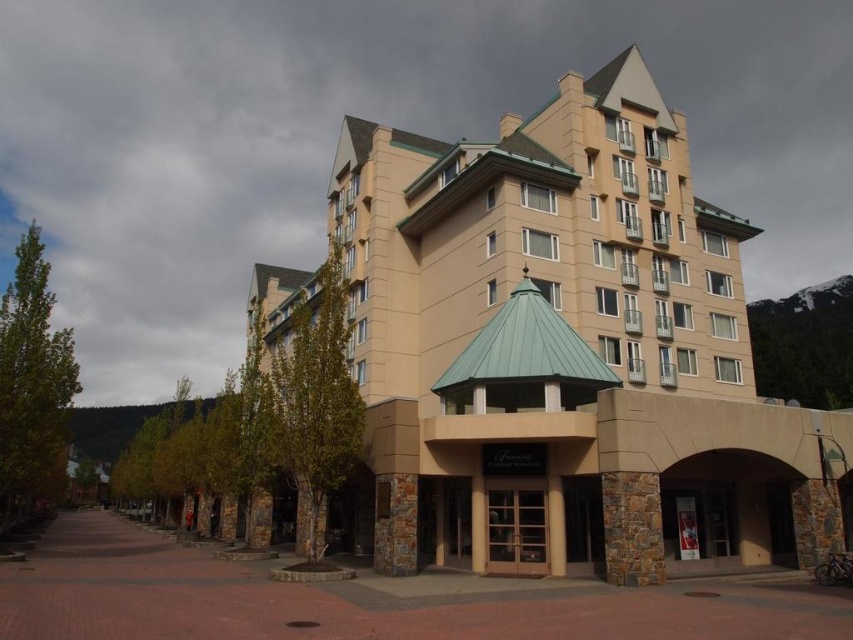
Question: Does beige stone building at center have a lesser width compared to brown wooden door at center?

Choices:
 (A) no
 (B) yes

Answer: (A)

Question: Is beige stone building at center positioned behind brown wooden door at center?

Choices:
 (A) no
 (B) yes

Answer: (A)

Question: Among these objects, which one is farthest from the camera?

Choices:
 (A) brown wooden door at center
 (B) beige stone building at center

Answer: (A)

Question: Which point appears farthest from the camera in this image?

Choices:
 (A) (515, 560)
 (B) (421, 428)

Answer: (B)

Question: Does beige stone building at center appear under brown wooden door at center?

Choices:
 (A) no
 (B) yes

Answer: (A)